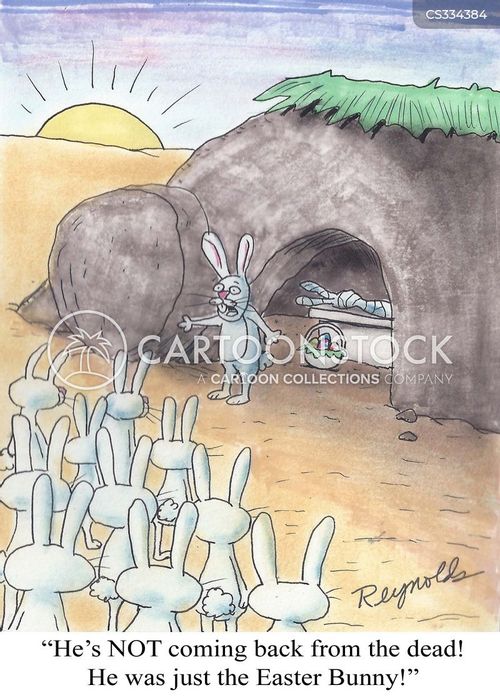
Locate an element on the screen. table top is located at coordinates (353, 318).